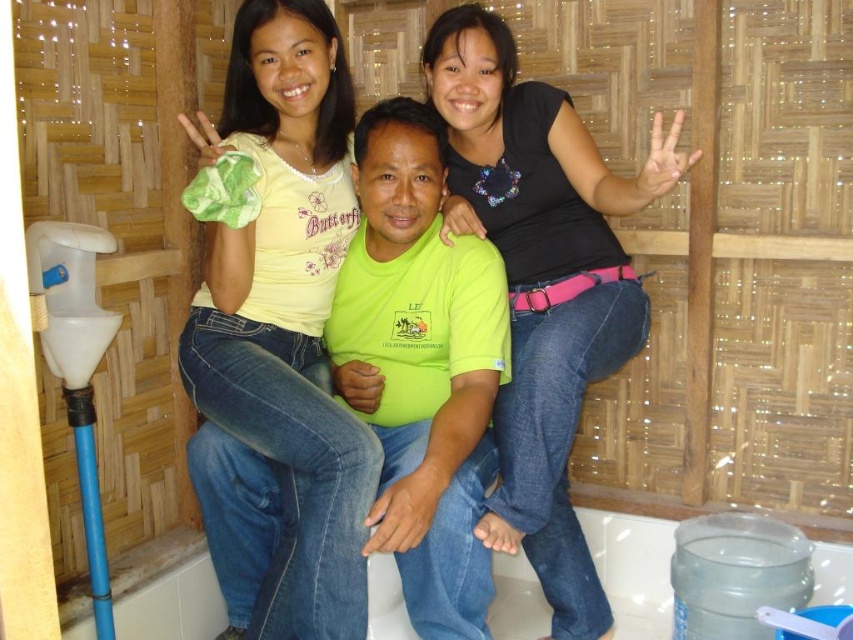
Question: Does matte yellow shirt at upper left have a lesser width compared to black matte shirt at center?

Choices:
 (A) yes
 (B) no

Answer: (A)

Question: Among these points, which one is farthest from the camera?

Choices:
 (A) (450, 182)
 (B) (281, 227)

Answer: (A)

Question: Is matte yellow shirt at upper left to the left of black matte shirt at center from the viewer's perspective?

Choices:
 (A) yes
 (B) no

Answer: (A)

Question: Does matte yellow shirt at upper left have a smaller size compared to black matte shirt at center?

Choices:
 (A) yes
 (B) no

Answer: (A)